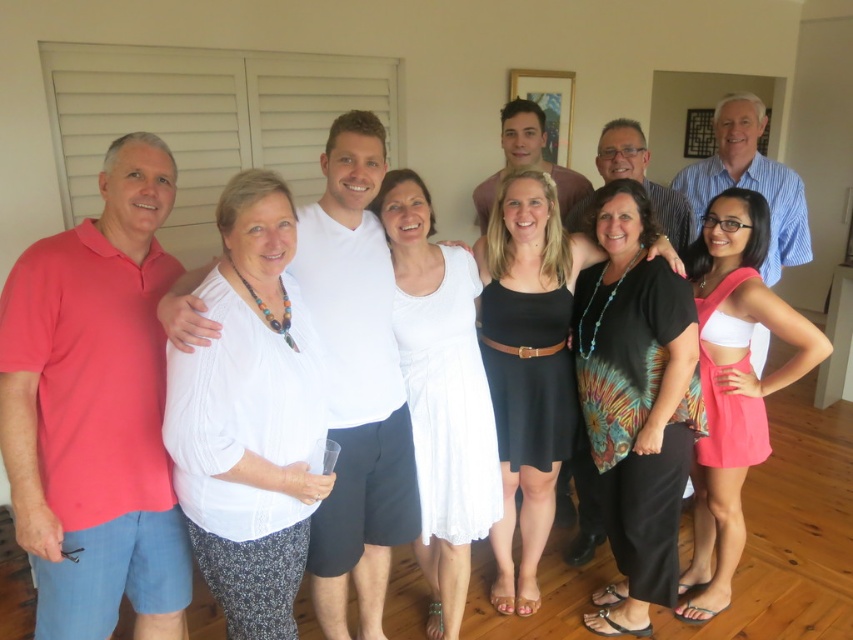
You are a photographer taking a photo of the group. You want to ensure that the white cotton dress at center is visible above the black dress at center. What adjustment can you make to achieve this?

The white cotton dress at center is currently below the black dress at center. To make it visible above, you can ask the person wearing the white cotton dress at center to step forward slightly or adjust their position so that they are positioned higher in the frame.